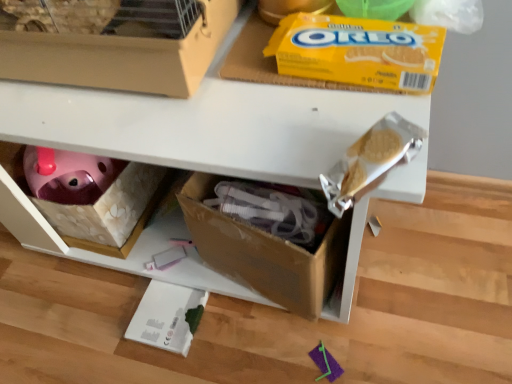
Describe the element at coordinates (114, 42) in the screenshot. I see `matte cardboard box at upper left` at that location.

Identify the location of cardboard box at lower center. (206, 123).

Is cardboard box at lower center thinner than yellow cardboard oreo at upper center?

In fact, cardboard box at lower center might be wider than yellow cardboard oreo at upper center.

Where is `cereal above the cardboard box at lower center (from the image's perspective)`? cereal above the cardboard box at lower center (from the image's perspective) is located at coordinates (358, 51).

Is cardboard box at lower center not near yellow cardboard oreo at upper center?

cardboard box at lower center is near yellow cardboard oreo at upper center, not far away.

From the image's perspective, is cardboard box at lower center beneath yellow cardboard oreo at upper center?

Yes, from the image's perspective, cardboard box at lower center is beneath yellow cardboard oreo at upper center.

Can you confirm if yellow cardboard oreo at upper center is positioned to the left of cardboard box at lower center?

No, yellow cardboard oreo at upper center is not to the left of cardboard box at lower center.

Are yellow cardboard oreo at upper center and cardboard box at lower center located far from each other?

Actually, yellow cardboard oreo at upper center and cardboard box at lower center are a little close together.

Between yellow cardboard oreo at upper center and cardboard box at lower center, which one is positioned behind?

yellow cardboard oreo at upper center is further from the camera.

Looking at the image, does yellow cardboard oreo at upper center seem bigger or smaller compared to cardboard box at lower center?

Clearly, yellow cardboard oreo at upper center is smaller in size than cardboard box at lower center.

Find the location of a particular element. box located above the yellow cardboard oreo at upper center (from a real-world perspective) is located at coordinates [x=114, y=42].

Is matte cardboard box at upper left next to yellow cardboard oreo at upper center and touching it?

No, matte cardboard box at upper left is not touching yellow cardboard oreo at upper center.

Is matte cardboard box at upper left shorter than yellow cardboard oreo at upper center?

No, matte cardboard box at upper left is not shorter than yellow cardboard oreo at upper center.

Considering the points (139, 36) and (346, 76), which point is in front, point (139, 36) or point (346, 76)?

The point (139, 36) is closer.

Which is in front, matte cardboard box at upper left or cardboard box at lower center?

matte cardboard box at upper left is more forward.

From the image's perspective, would you say matte cardboard box at upper left is positioned over cardboard box at lower center?

Correct, matte cardboard box at upper left appears higher than cardboard box at lower center in the image.

Could you tell me if matte cardboard box at upper left is turned towards cardboard box at lower center?

No, matte cardboard box at upper left does not turn towards cardboard box at lower center.

Is matte cardboard box at upper left to the left or to the right of cardboard box at lower center in the image?

In the image, matte cardboard box at upper left appears on the left side of cardboard box at lower center.

Can you confirm if cardboard box at lower center is wider than matte cardboard box at upper left?

Yes.

Does cardboard box at lower center have a larger size compared to matte cardboard box at upper left?

Indeed, cardboard box at lower center has a larger size compared to matte cardboard box at upper left.

From the image's perspective, is cardboard box at lower center on matte cardboard box at upper left?

No, from the image's perspective, cardboard box at lower center is not above matte cardboard box at upper left.

Is yellow cardboard oreo at upper center surrounding matte cardboard box at upper left?

No, matte cardboard box at upper left is not surrounded by yellow cardboard oreo at upper center.

From the image's perspective, is yellow cardboard oreo at upper center beneath matte cardboard box at upper left?

Indeed, from the image's perspective, yellow cardboard oreo at upper center is shown beneath matte cardboard box at upper left.

Is yellow cardboard oreo at upper center touching matte cardboard box at upper left?

yellow cardboard oreo at upper center and matte cardboard box at upper left are clearly separated.

Which is more to the right, yellow cardboard oreo at upper center or matte cardboard box at upper left?

yellow cardboard oreo at upper center is more to the right.

Find the location of a particular element. shelf to the left of yellow cardboard oreo at upper center is located at coordinates (206, 123).

Where is `cereal that appears on the right of cardboard box at lower center`? cereal that appears on the right of cardboard box at lower center is located at coordinates (358, 51).

Based on the photo, looking at the image, which one is located closer to cardboard box at lower center, matte cardboard box at upper left or yellow cardboard oreo at upper center?

The object closer to cardboard box at lower center is matte cardboard box at upper left.

From the image, which object appears to be farther from matte cardboard box at upper left, yellow cardboard oreo at upper center or cardboard box at lower center?

yellow cardboard oreo at upper center is positioned further to the anchor matte cardboard box at upper left.

Considering their positions, is cardboard box at lower center positioned further to matte cardboard box at upper left than yellow cardboard oreo at upper center?

yellow cardboard oreo at upper center is further to matte cardboard box at upper left.

From the image, which object appears to be nearer to cardboard box at lower center, yellow cardboard oreo at upper center or matte cardboard box at upper left?

matte cardboard box at upper left lies closer to cardboard box at lower center than the other object.

Estimate the real-world distances between objects in this image. Which object is further from yellow cardboard oreo at upper center, matte cardboard box at upper left or cardboard box at lower center?

cardboard box at lower center.

From the image, which object appears to be farther from yellow cardboard oreo at upper center, cardboard box at lower center or matte cardboard box at upper left?

cardboard box at lower center is further to yellow cardboard oreo at upper center.

The height and width of the screenshot is (384, 512). Identify the location of shelf situated between matte cardboard box at upper left and yellow cardboard oreo at upper center from left to right. (206, 123).